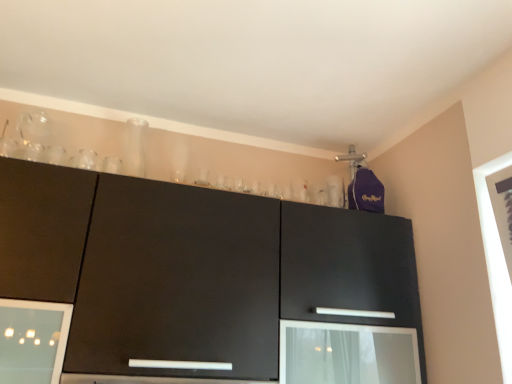
Locate an element on the screen. This screenshot has width=512, height=384. matte black cabinet at upper center is located at coordinates (199, 285).

What do you see at coordinates (199, 285) in the screenshot? The image size is (512, 384). I see `matte black cabinet at upper center` at bounding box center [199, 285].

Describe the element at coordinates (347, 354) in the screenshot. I see `transparent glass screen door at lower center` at that location.

Identify the location of transparent glass screen door at lower center. (347, 354).

From the picture: In order to face transparent glass screen door at lower center, should I rotate leftwards or rightwards?

To face it directly, rotate right by 12.204 degrees.

Where is `matte black cabinet at upper center`? The image size is (512, 384). matte black cabinet at upper center is located at coordinates (199, 285).

Which object is positioned more to the right, matte black cabinet at upper center or transparent glass screen door at lower center?

transparent glass screen door at lower center.

Is matte black cabinet at upper center behind transparent glass screen door at lower center?

No, matte black cabinet at upper center is in front of transparent glass screen door at lower center.

Does point (191, 348) come closer to viewer compared to point (298, 335)?

Yes, it is in front of point (298, 335).

From the image's perspective, relative to transparent glass screen door at lower center, is matte black cabinet at upper center above or below?

matte black cabinet at upper center is above transparent glass screen door at lower center.

From a real-world perspective, is matte black cabinet at upper center under transparent glass screen door at lower center?

No, from a real-world perspective, matte black cabinet at upper center is not beneath transparent glass screen door at lower center.

Is matte black cabinet at upper center wider than transparent glass screen door at lower center?

Indeed, matte black cabinet at upper center has a greater width compared to transparent glass screen door at lower center.

Considering the sizes of objects matte black cabinet at upper center and transparent glass screen door at lower center in the image provided, who is taller, matte black cabinet at upper center or transparent glass screen door at lower center?

matte black cabinet at upper center.

Can you confirm if matte black cabinet at upper center is smaller than transparent glass screen door at lower center?

No.

In the scene shown: Is matte black cabinet at upper center not within transparent glass screen door at lower center?

Yes, matte black cabinet at upper center is not within transparent glass screen door at lower center.

Is matte black cabinet at upper center in contact with transparent glass screen door at lower center?

No, matte black cabinet at upper center is not in contact with transparent glass screen door at lower center.

Does matte black cabinet at upper center turn towards transparent glass screen door at lower center?

Yes, matte black cabinet at upper center is aimed at transparent glass screen door at lower center.

Can you tell me how much matte black cabinet at upper center and transparent glass screen door at lower center differ in facing direction?

There is a 2.33-degree angle between the facing directions of matte black cabinet at upper center and transparent glass screen door at lower center.

At what (x,y) coordinates should I click in order to perform the action: click on cabinetry above the transparent glass screen door at lower center (from the image's perspective). Please return your answer as a coordinate pair (x, y). Looking at the image, I should click on (199, 285).

Can you confirm if transparent glass screen door at lower center is positioned to the left of matte black cabinet at upper center?

No.

Considering the positions of objects transparent glass screen door at lower center and matte black cabinet at upper center in the image provided, who is in front, transparent glass screen door at lower center or matte black cabinet at upper center?

matte black cabinet at upper center.

Which point is more forward, (400, 351) or (27, 225)?

Positioned in front is point (27, 225).

From the image's perspective, is transparent glass screen door at lower center positioned above or below matte black cabinet at upper center?

From the image's perspective, transparent glass screen door at lower center appears below matte black cabinet at upper center.

From a real-world perspective, is transparent glass screen door at lower center below matte black cabinet at upper center?

Indeed, from a real-world perspective, transparent glass screen door at lower center is positioned beneath matte black cabinet at upper center.

Is transparent glass screen door at lower center thinner than matte black cabinet at upper center?

Indeed, transparent glass screen door at lower center has a lesser width compared to matte black cabinet at upper center.

Between transparent glass screen door at lower center and matte black cabinet at upper center, which one has more height?

Standing taller between the two is matte black cabinet at upper center.

Who is bigger, transparent glass screen door at lower center or matte black cabinet at upper center?

matte black cabinet at upper center.

Is transparent glass screen door at lower center completely or partially outside of matte black cabinet at upper center?

No.

Is there a large distance between transparent glass screen door at lower center and matte black cabinet at upper center?

No, transparent glass screen door at lower center is in close proximity to matte black cabinet at upper center.

Is transparent glass screen door at lower center turned away from matte black cabinet at upper center?

That's right, transparent glass screen door at lower center is facing away from matte black cabinet at upper center.

How different are the orientations of transparent glass screen door at lower center and matte black cabinet at upper center in degrees?

2.33 degrees separate the facing orientations of transparent glass screen door at lower center and matte black cabinet at upper center.

The width and height of the screenshot is (512, 384). In order to click on cabinetry above the transparent glass screen door at lower center (from a real-world perspective) in this screenshot , I will do `click(199, 285)`.

At what (x,y) coordinates should I click in order to perform the action: click on screen door behind the matte black cabinet at upper center. Please return your answer as a coordinate pair (x, y). This screenshot has width=512, height=384. Looking at the image, I should click on (347, 354).

Locate an element on the screen. cabinetry above the transparent glass screen door at lower center (from the image's perspective) is located at coordinates (199, 285).